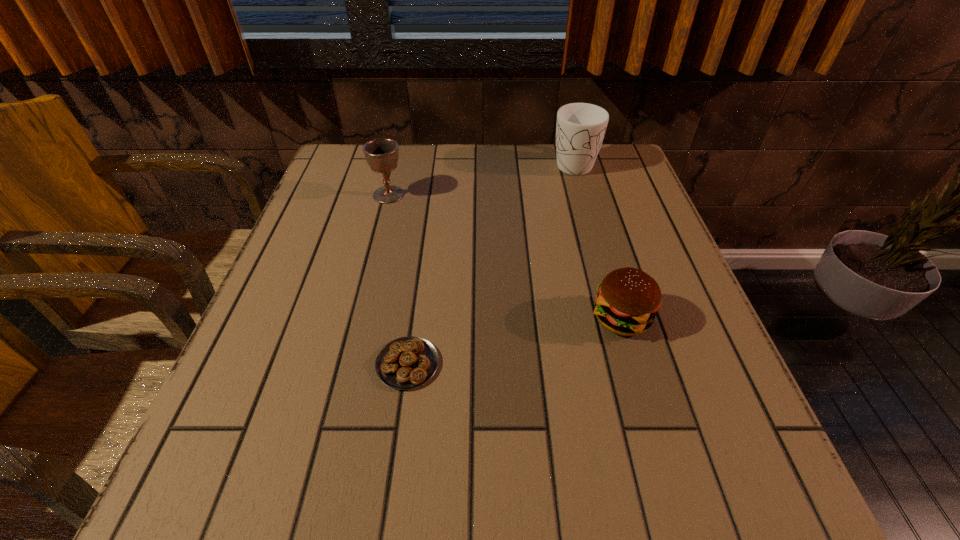
At what (x,y) coordinates should I click in order to perform the action: click on mug located in the far edge section of the desktop. Please return your answer as a coordinate pair (x, y). Looking at the image, I should click on (580, 129).

This screenshot has width=960, height=540. I want to click on chalice at the far edge, so click(381, 154).

Identify the location of object positioned at the left edge. This screenshot has height=540, width=960. (381, 154).

Find the location of a particular element. Image resolution: width=960 pixels, height=540 pixels. mug that is at the right edge is located at coordinates (580, 129).

You are a GUI agent. You are given a task and a screenshot of the screen. Output one action in this format:
    pyautogui.click(x=<x>, y=<y>)
    Task: Click on the hamburger at the right edge
    
    Given the screenshot: What is the action you would take?
    pyautogui.click(x=628, y=299)

The image size is (960, 540). What are the coordinates of `object positioned at the far left corner` in the screenshot? It's located at (381, 154).

At what (x,y) coordinates should I click in order to perform the action: click on object that is at the far right corner. Please return your answer as a coordinate pair (x, y). Looking at the image, I should click on (580, 129).

This screenshot has width=960, height=540. In order to click on vacant space at the far edge of the desktop in this screenshot , I will do `click(413, 158)`.

Where is `free spot at the near edge of the desktop`? free spot at the near edge of the desktop is located at coordinates (311, 464).

Identify the location of vacant area at the left edge of the desktop. (295, 285).